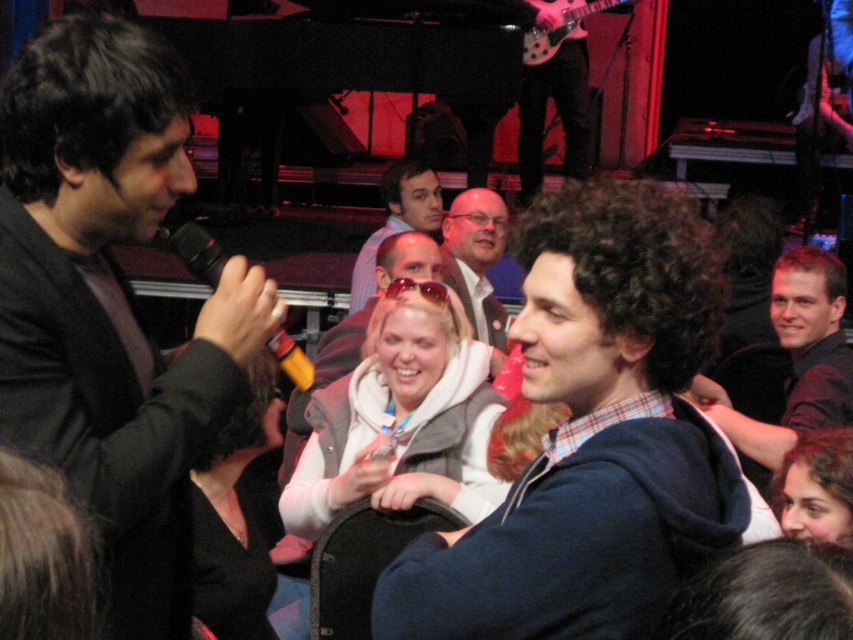
You are a photographer positioned at the back of the venue. You want to take a photo of the white fleece vest at center and the light brown hair at center. Can you fit both in your camera frame if your camera has a 1.5 meter field of view?

The white fleece vest at center is 1.78 meters away from the light brown hair at center, which exceeds the camera frame of 1.5 meters. Therefore, both cannot be captured in the same photo.

You are a photographer at the event and want to capture a photo where both the white fleece vest at center and the dark brown hair at right are visible. Based on their heights, which one should you focus on to ensure both are in frame?

Since the white fleece vest at center is shorter than the dark brown hair at right, you should focus on the dark brown hair at right to ensure both are visible in the photo.